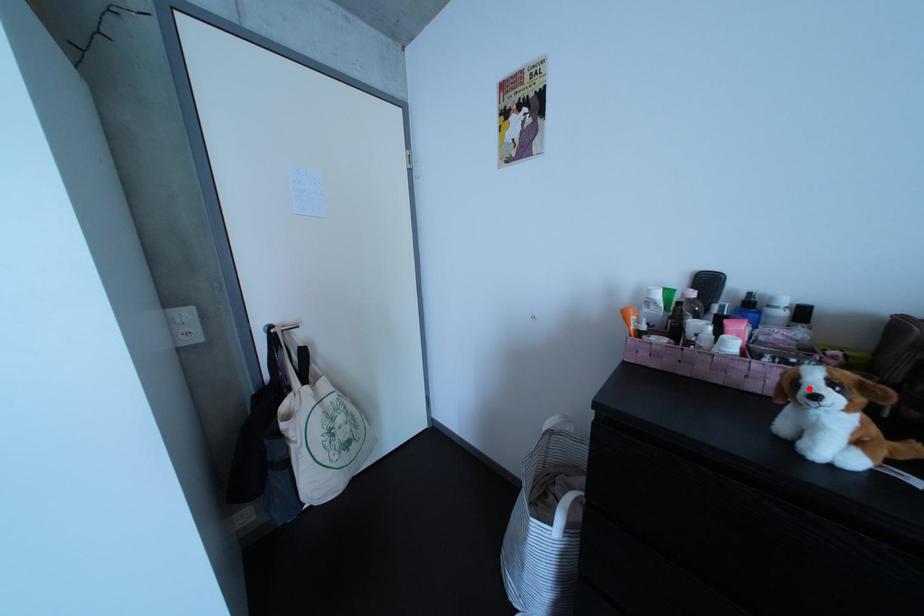
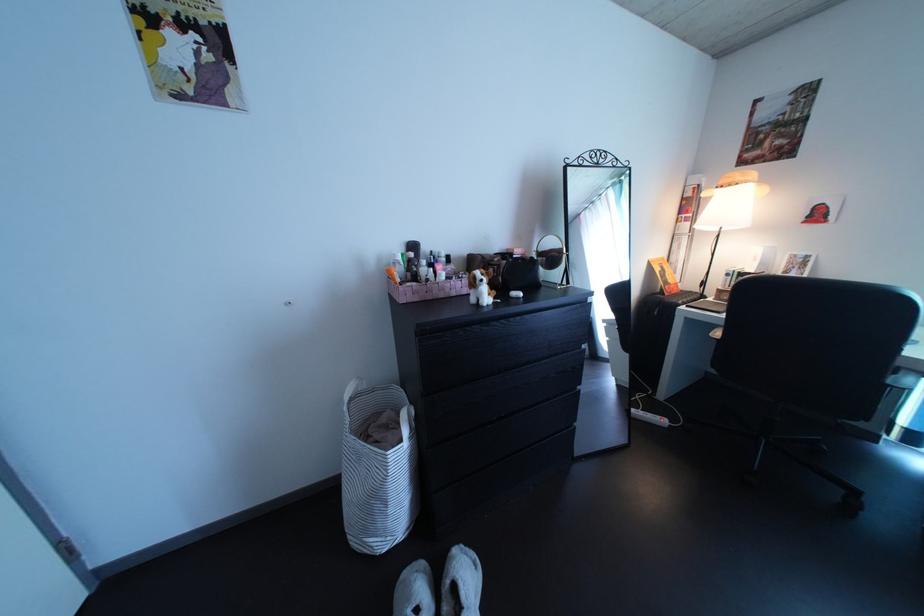
In the second image, find the point that corresponds to the highlighted location in the first image.

(489, 286)